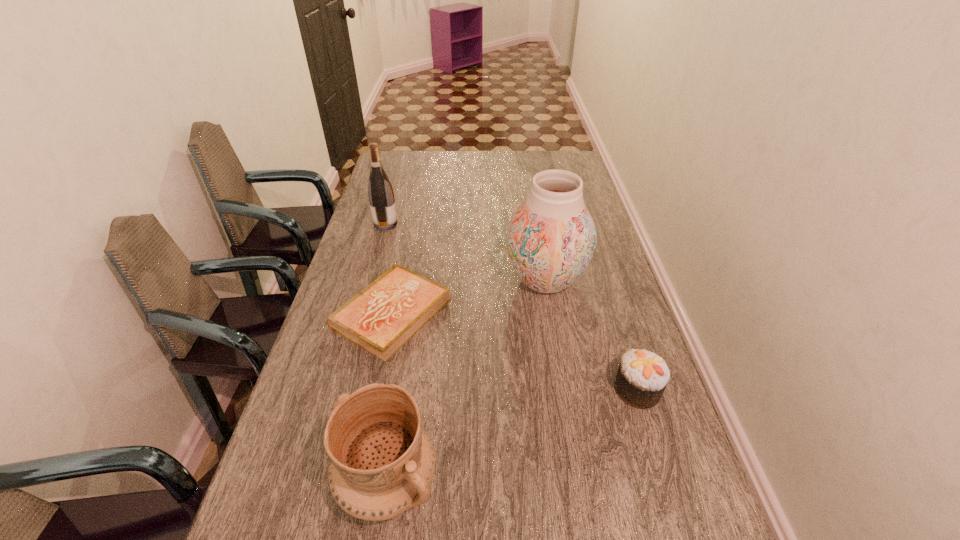
Locate an element on the screen. vacant space located 0.220m on the left of the second shortest object is located at coordinates (524, 389).

Locate an element on the screen. The image size is (960, 540). vacant area situated on the right of the hardback book is located at coordinates (564, 314).

You are a GUI agent. You are given a task and a screenshot of the screen. Output one action in this format:
    pyautogui.click(x=<x>, y=<y>)
    Task: Click on the wine bottle that is at the left edge
    
    Given the screenshot: What is the action you would take?
    click(380, 192)

At what (x,y) coordinates should I click in order to perform the action: click on pottery that is at the left edge. Please return your answer as a coordinate pair (x, y). The height and width of the screenshot is (540, 960). Looking at the image, I should click on (382, 462).

This screenshot has height=540, width=960. Find the location of `hardback book located in the left edge section of the desktop`. hardback book located in the left edge section of the desktop is located at coordinates (381, 318).

Locate an element on the screen. vase located at the right edge is located at coordinates (551, 238).

Find the location of a particular element. The width and height of the screenshot is (960, 540). cupcake present at the right edge is located at coordinates (642, 376).

Image resolution: width=960 pixels, height=540 pixels. Identify the location of vacant space at the far edge of the desktop. (522, 170).

In the image, there is a desktop. Identify the location of vacant region at the left edge. (354, 239).

Locate an element on the screen. vacant space at the right edge of the desktop is located at coordinates (631, 449).